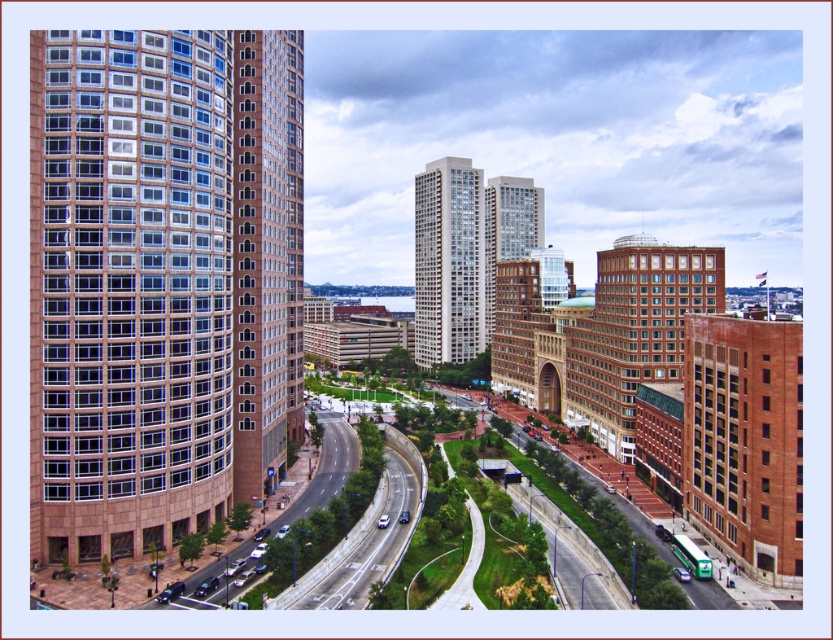
Between point (335, 602) and point (312, 492), which one is positioned in front?

Point (335, 602)

Does point (382, 531) come in front of point (347, 440)?

Yes, point (382, 531) is in front of point (347, 440).

This screenshot has width=833, height=640. Find the location of `asphalt road at center`. asphalt road at center is located at coordinates (365, 536).

Between brown glassy building at left and brick building at lower right, which one is positioned lower?

Positioned lower is brick building at lower right.

Measure the distance between brown glassy building at left and brick building at lower right.

brown glassy building at left is 73.19 meters from brick building at lower right.

You are a GUI agent. You are given a task and a screenshot of the screen. Output one action in this format:
    pyautogui.click(x=<x>, y=<y>)
    Task: Click on the brown glassy building at left
    The width and height of the screenshot is (833, 640).
    Given the screenshot: What is the action you would take?
    (161, 280)

Locate an element on the screen. brown glassy building at left is located at coordinates (161, 280).

Consider the image. Is brown brick building at left above matte glass building at center?

No, brown brick building at left is not above matte glass building at center.

Is point (273, 180) positioned behind point (490, 208)?

No, it is not.

Identify the location of brown brick building at left. [267, 257].